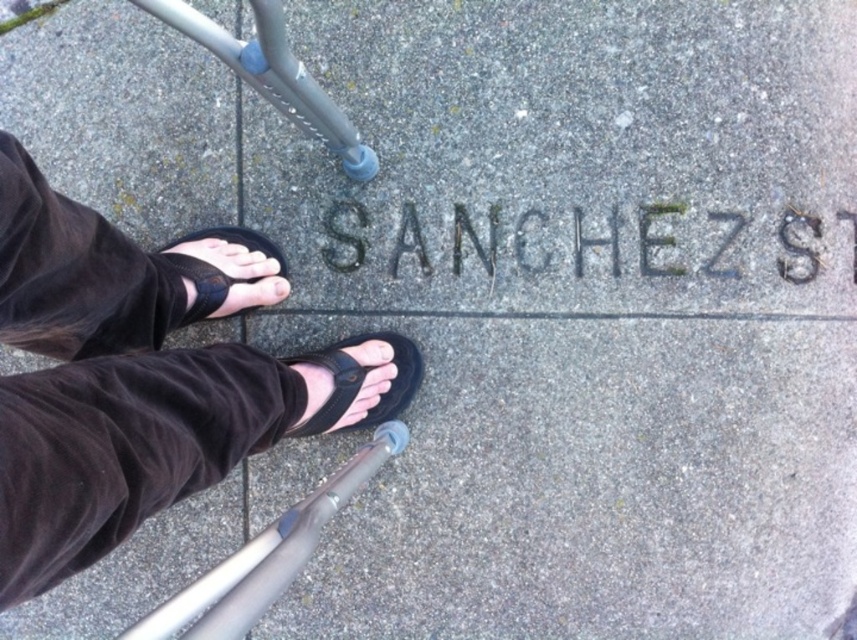
Question: Is black leather sandals at center to the right of white matte toe at center from the viewer's perspective?

Choices:
 (A) yes
 (B) no

Answer: (B)

Question: Which of the following is the closest to the observer?

Choices:
 (A) black rubber sandal at center
 (B) black leather sandals at center
 (C) pinkish skin at center
 (D) black fabric sandal at lower center

Answer: (B)

Question: Is silver metallic crutch at lower left to the left of pinkish skin at center from the viewer's perspective?

Choices:
 (A) yes
 (B) no

Answer: (B)

Question: Which of these objects is positioned farthest from the black leather sandals at center?

Choices:
 (A) black fabric sandal at lower center
 (B) black rubber sandal at center
 (C) black textured lettering at center

Answer: (C)

Question: Which is nearer to the pink flesh at center?

Choices:
 (A) black rubber sandal at center
 (B) white matte toe at center

Answer: (A)

Question: Can you confirm if black leather sandals at center is positioned above pink flesh at center?

Choices:
 (A) yes
 (B) no

Answer: (A)